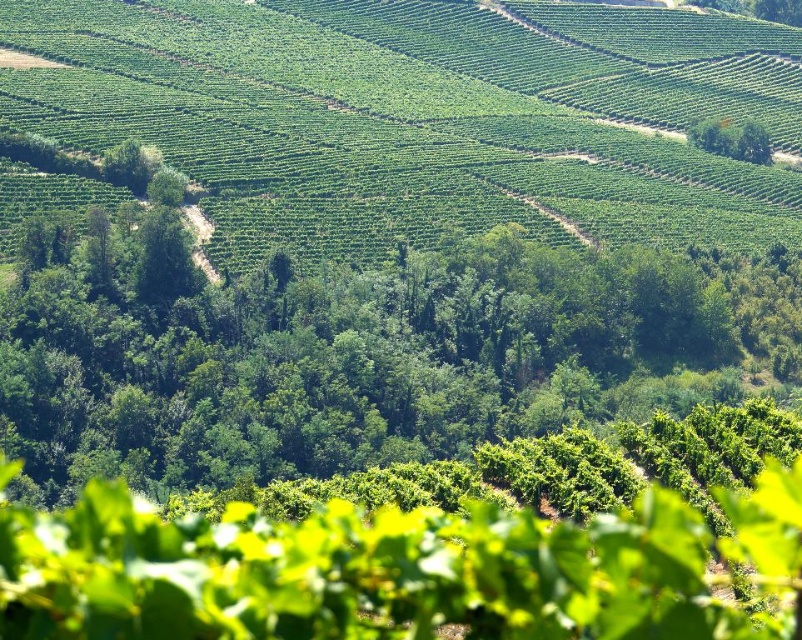
Is green leafy tree at center thinner than green leafy tree at upper right?

No, green leafy tree at center is not thinner than green leafy tree at upper right.

Between green leafy tree at center and green leafy tree at upper right, which one is positioned lower?

Positioned lower is green leafy tree at center.

The height and width of the screenshot is (640, 802). Find the location of `green leafy tree at center`. green leafy tree at center is located at coordinates (365, 356).

The height and width of the screenshot is (640, 802). Find the location of `green leafy tree at center`. green leafy tree at center is located at coordinates click(x=365, y=356).

Is point (669, 115) farther from camera compared to point (695, 364)?

That is True.

Is green leafy hillside at center above green leafy tree at center?

Correct, green leafy hillside at center is located above green leafy tree at center.

Where is `green leafy hillside at center`? green leafy hillside at center is located at coordinates (423, 116).

Who is more forward, (329, 13) or (759, 141)?

Point (759, 141) is more forward.

In order to click on green leafy hillside at center in this screenshot , I will do `click(423, 116)`.

Is point (577, 186) closer to viewer compared to point (747, 160)?

Yes, point (577, 186) is closer to viewer.

The height and width of the screenshot is (640, 802). Find the location of `green leafy hillside at center`. green leafy hillside at center is located at coordinates (423, 116).